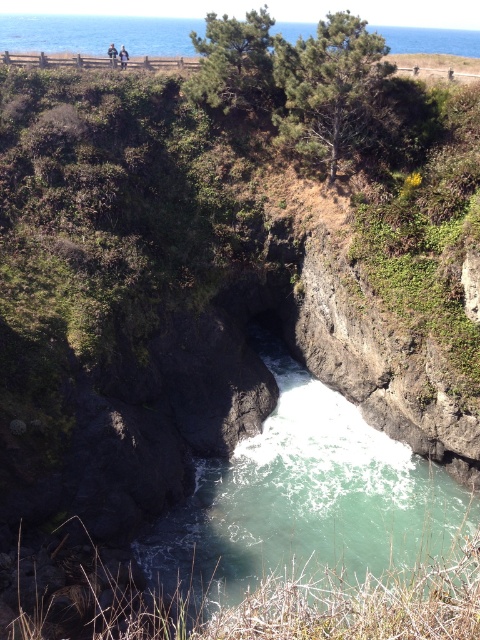
In the scene shown: Which is below, green mossy rock at upper center or blurred human figure at upper center?

Positioned lower is green mossy rock at upper center.

Between point (458, 77) and point (109, 61), which one is positioned behind?

Point (109, 61)

Identify the location of green mossy rock at upper center. click(436, 65).

Is green smooth river at center to the left of blurred human figure at upper center from the viewer's perspective?

In fact, green smooth river at center is to the right of blurred human figure at upper center.

Is green smooth river at center shorter than blurred human figure at upper center?

Indeed, green smooth river at center has a lesser height compared to blurred human figure at upper center.

Which is behind, point (342, 547) or point (110, 49)?

The point (110, 49) is behind.

Locate an element on the screen. The width and height of the screenshot is (480, 640). green smooth river at center is located at coordinates (305, 499).

Who is positioned more to the right, green smooth river at center or green mossy rock at upper center?

green smooth river at center

Does green smooth river at center appear on the left side of green mossy rock at upper center?

No, green smooth river at center is not to the left of green mossy rock at upper center.

Measure the distance between point (407, 499) and camera.

Point (407, 499) is 25.79 meters from camera.

Locate an element on the screen. green smooth river at center is located at coordinates 305,499.